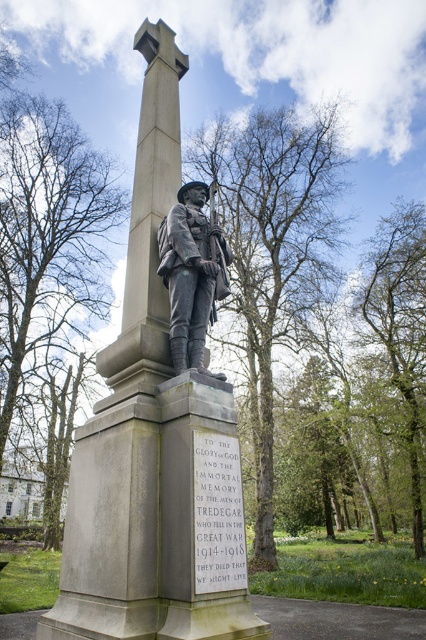
Is gray stone statue at center above bronze statue at center?

Yes.

Is point (138, 122) less distant than point (224, 280)?

No, (138, 122) is further to viewer.

What do you see at coordinates (144, 432) in the screenshot? The height and width of the screenshot is (640, 426). I see `gray stone statue at center` at bounding box center [144, 432].

Locate an element on the screen. gray stone statue at center is located at coordinates (144, 432).